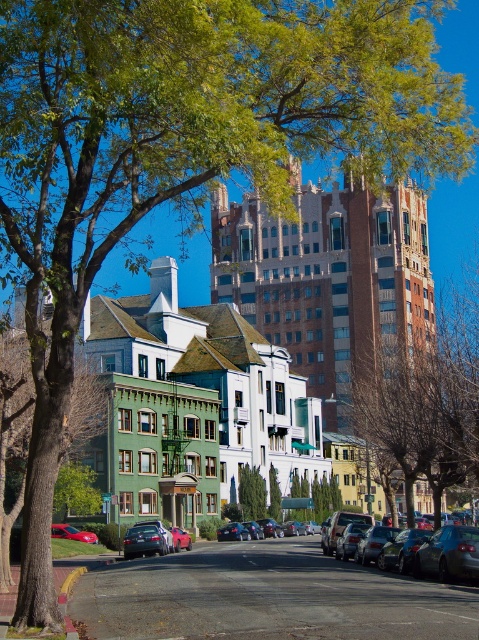
You are a city planner analyzing the layout of this urban street scene. The image shows a brown textured building at center. Can you determine its exact location in terms of coordinates?

The brown textured building at center is located at coordinates point (426, 400).

You are standing at the center of the road in the urban street scene. You see two points marked on the image, point (434,406) and point (467,561). Which point is closer to you?

Point (434,406) is further to the camera than point (467,561), so the point closer to you is point (467,561).

You are a delivery person trying to find a parking spot for your van. You see the brown textured building at center and the metallic blue sedan at center. Which object is positioned higher up in the image?

The brown textured building at center is located above the metallic blue sedan at center, so it is positioned higher up in the image.